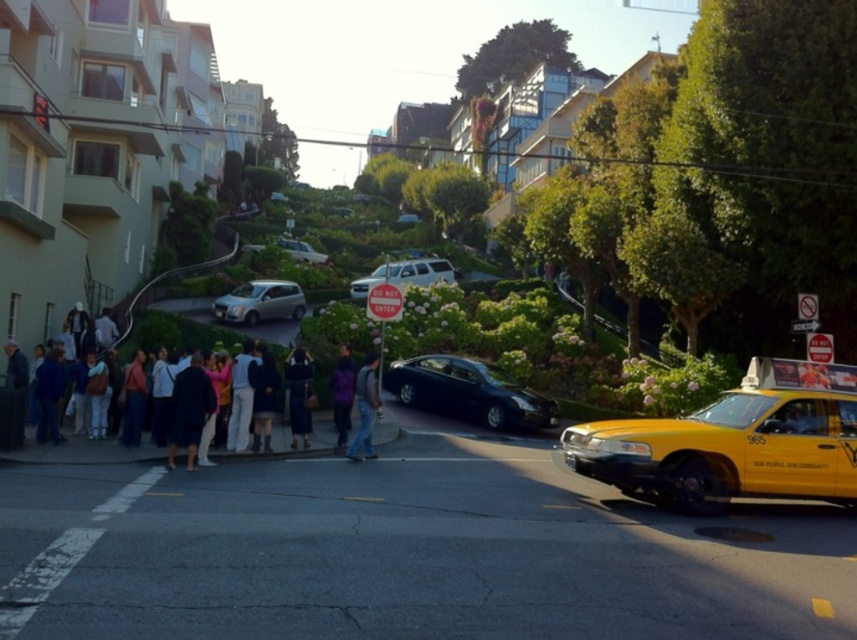
Question: Is dark fabric coat at lower left wider than denim jeans at center?

Choices:
 (A) no
 (B) yes

Answer: (B)

Question: Which object is positioned farthest from the glossy black sedan at center?

Choices:
 (A) dark blue fabric at center
 (B) silver metallic car at center
 (C) satin silver car at center
 (D) dark fabric coat at lower left

Answer: (B)

Question: Among these points, which one is nearest to the camera?

Choices:
 (A) (298, 387)
 (B) (295, 246)
 (C) (291, 285)

Answer: (A)

Question: Does satin silver car at center appear under silver metallic car at center?

Choices:
 (A) no
 (B) yes

Answer: (B)

Question: Does glossy black sedan at center have a larger size compared to denim jeans at center?

Choices:
 (A) no
 (B) yes

Answer: (B)

Question: Which of the following is the farthest from the observer?

Choices:
 (A) (367, 288)
 (B) (183, 419)
 (C) (298, 432)

Answer: (A)